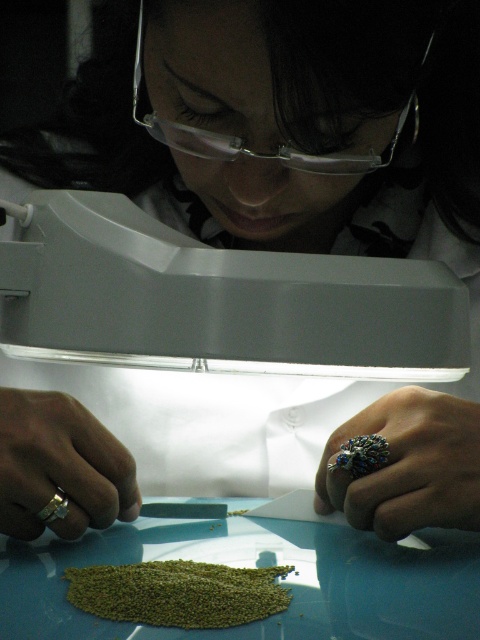
You are a lab technician who needs to place a protective cover over the silver metallic ring at lower right and the clear plastic goggles at upper center. Based on their sizes, which object requires a larger cover?

The clear plastic goggles at upper center require a larger cover because the silver metallic ring at lower right is shorter than clear plastic goggles at upper center.

You are a lab technician who needs to place the silver metallic ring at lower right and the clear plastic goggles at upper center into a drawer. The drawer has a width of 10 cm. Which object will fit better in the drawer based on their sizes?

The silver metallic ring at lower right has a smaller width than the clear plastic goggles at upper center, so it will fit better in the 10 cm wide drawer.

You are a researcher in a lab looking at the silver metallic ring at lower right and the gold ring at lower left on the table. Which ring is positioned higher on the table?

The silver metallic ring at lower right is located above the gold ring at lower left, so it is positioned higher on the table.